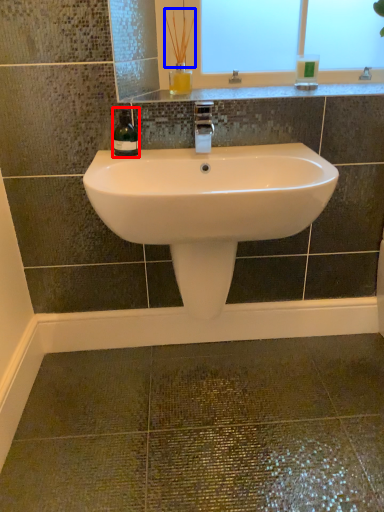
Question: Which object is further to the camera taking this photo, wine bottle (highlighted by a red box) or plant (highlighted by a blue box)?

Choices:
 (A) wine bottle
 (B) plant

Answer: (B)